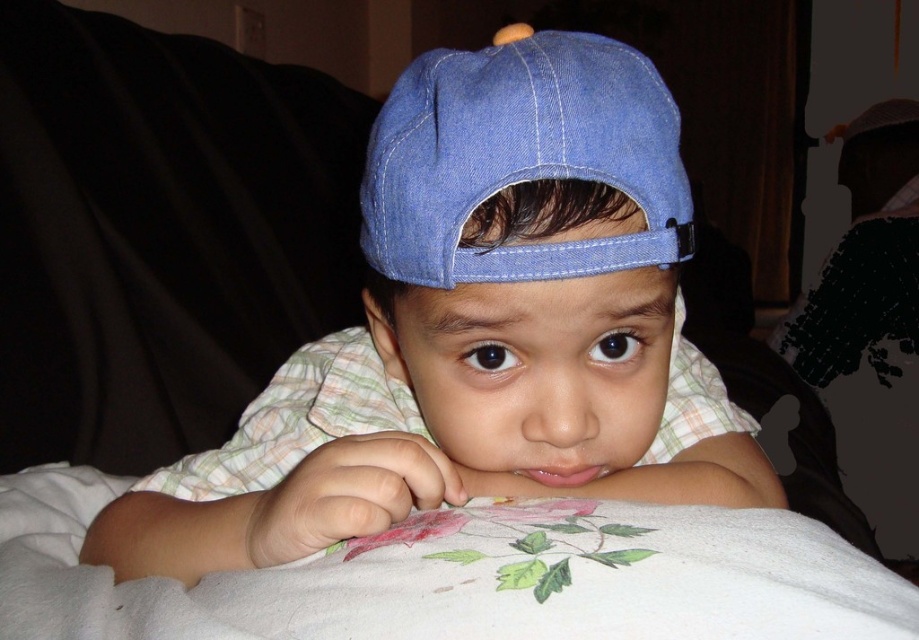
Question: Is denim cap at center positioned behind denim baseball cap at center?

Choices:
 (A) no
 (B) yes

Answer: (B)

Question: Does denim cap at center have a lesser width compared to denim baseball cap at center?

Choices:
 (A) no
 (B) yes

Answer: (A)

Question: Can you confirm if denim cap at center is positioned to the left of denim baseball cap at center?

Choices:
 (A) yes
 (B) no

Answer: (A)